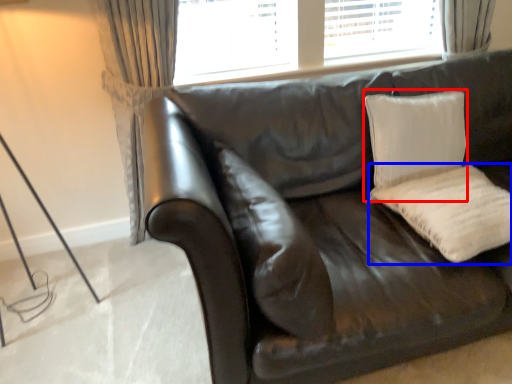
Question: Which object appears farthest to the camera in this image, pillow (highlighted by a red box) or pillow (highlighted by a blue box)?

Choices:
 (A) pillow
 (B) pillow

Answer: (A)